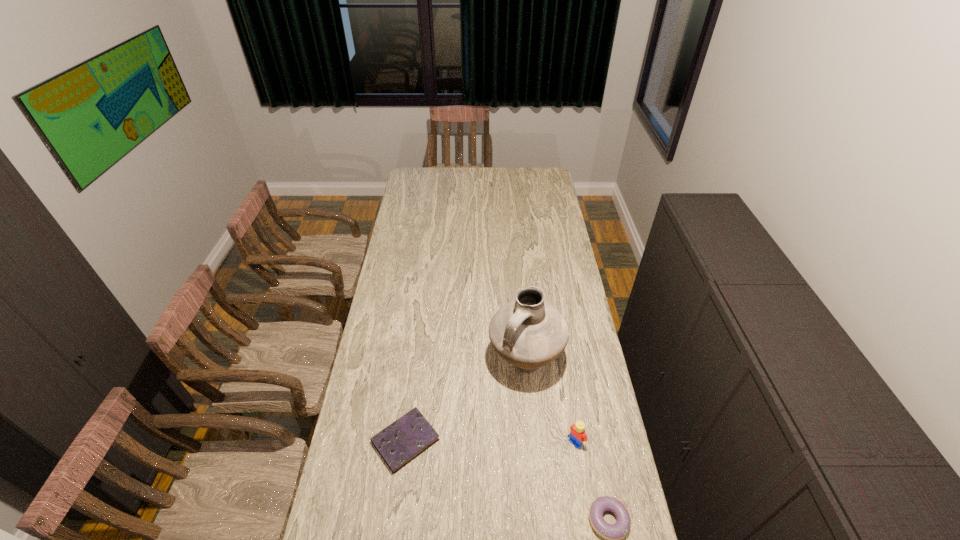
Locate an element on the screen. This screenshot has width=960, height=540. vacant space situated on the face of the third shortest object is located at coordinates (492, 530).

The width and height of the screenshot is (960, 540). I want to click on free space located 0.160m on the face of the third shortest object, so click(539, 482).

Locate an element on the screen. This screenshot has height=540, width=960. object at the left edge is located at coordinates (402, 441).

Image resolution: width=960 pixels, height=540 pixels. I want to click on pitcher at the right edge, so click(x=528, y=332).

Find the location of a particular element. This screenshot has width=960, height=540. Lego located at the right edge is located at coordinates (577, 433).

At what (x,y) coordinates should I click in order to perform the action: click on vacant position at the far edge of the desktop. Please return your answer as a coordinate pair (x, y). The image size is (960, 540). Looking at the image, I should click on (522, 168).

At what (x,y) coordinates should I click in order to perform the action: click on vacant area at the left edge of the desktop. Please return your answer as a coordinate pair (x, y). The image size is (960, 540). Looking at the image, I should click on coord(379,351).

The width and height of the screenshot is (960, 540). In order to click on free space at the right edge in this screenshot , I will do `click(605, 410)`.

Where is `free space at the far right corner`? free space at the far right corner is located at coordinates (544, 185).

You are a GUI agent. You are given a task and a screenshot of the screen. Output one action in this format:
    pyautogui.click(x=<x>, y=<y>)
    Task: Click on the vacant area that lies between the pitcher and the diary
    This screenshot has height=540, width=960.
    Given the screenshot: What is the action you would take?
    pyautogui.click(x=466, y=401)